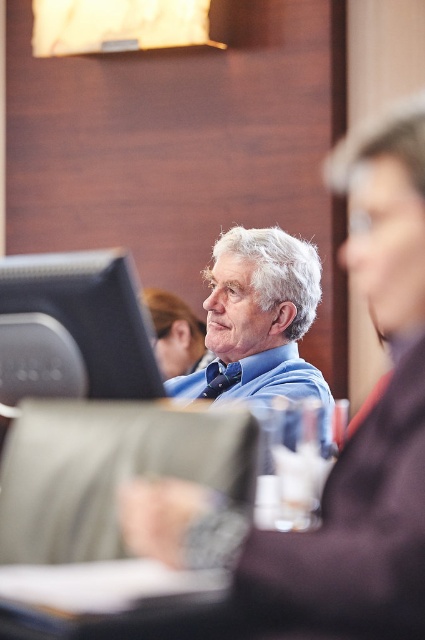
You are attending a meeting in this room and need to present a slide. The black glossy monitor at left and the blue shirt at center are in your line of sight. Which object should you look at to adjust the slide content?

You should look at the black glossy monitor at left to adjust the slide content because it is in front of the blue shirt at center and likely the screen where the presentation is displayed.

You are attending a meeting and need to present a slide. You see the black glossy monitor at left and the blue shirt at center. Which object is closer to the bottom edge of the frame?

The black glossy monitor at left is located below the blue shirt at center, so it is closer to the bottom edge of the frame.